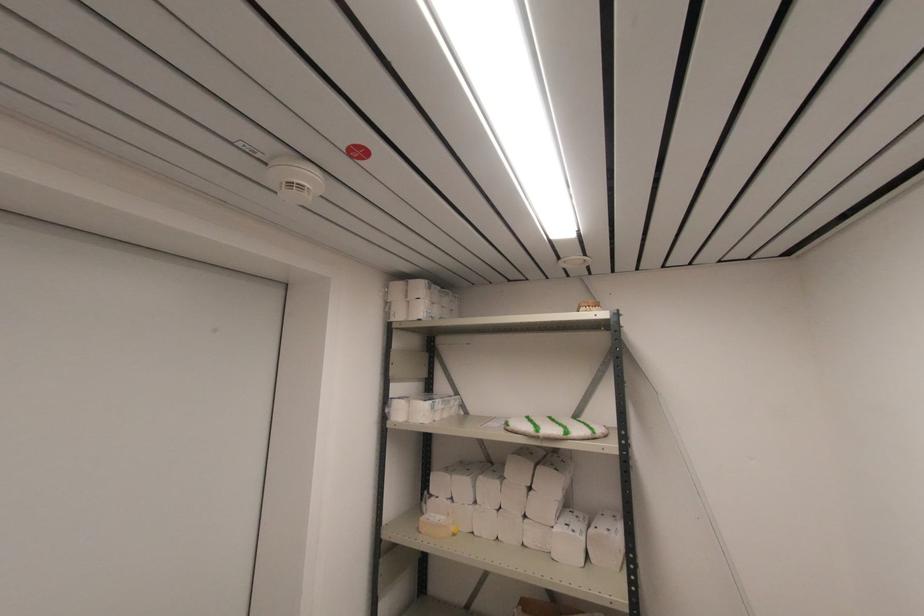
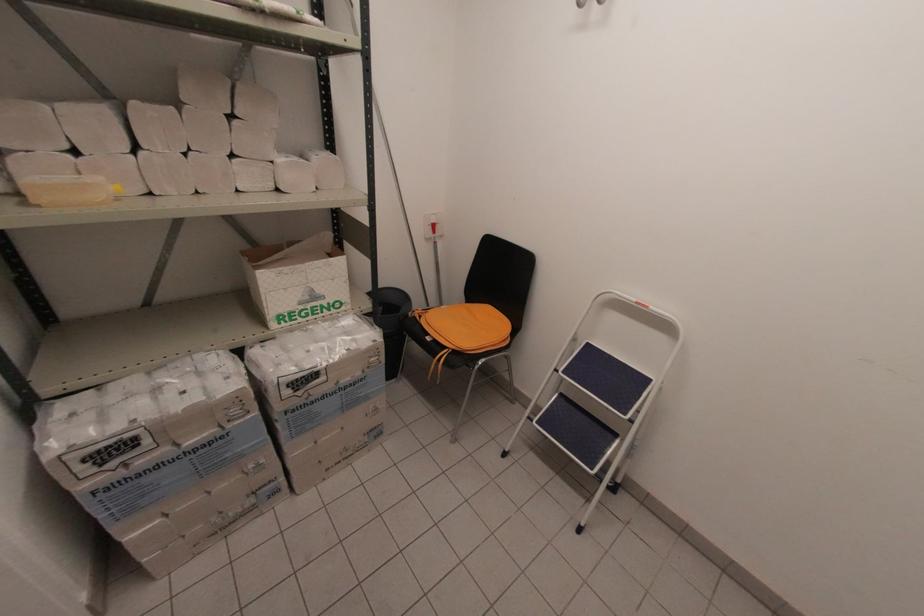
The first image is from the beginning of the video and the second image is from the end. How did the camera likely rotate when shooting the video?

The camera rotated toward right-down.